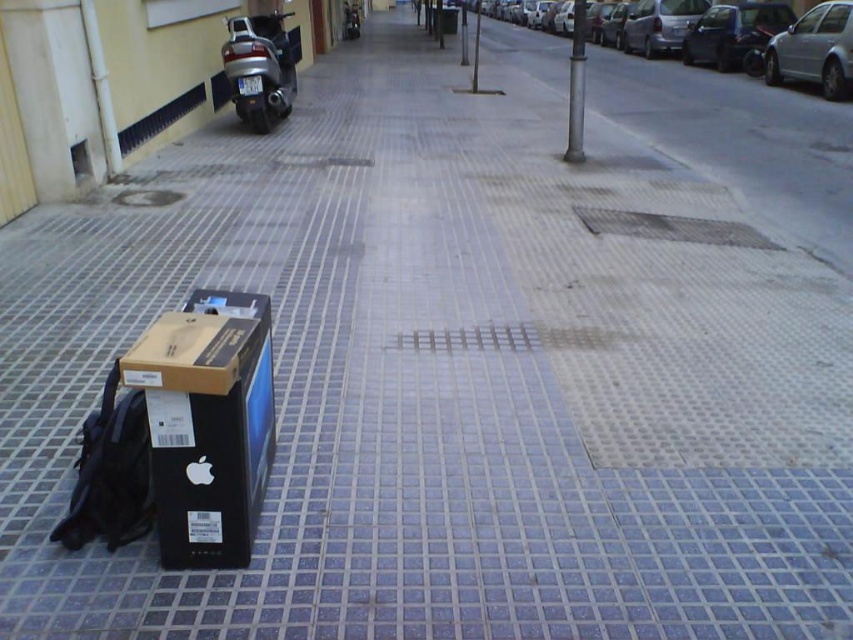
Can you confirm if silver metallic sedan at right is thinner than metallic silver motorcycle at upper center?

Indeed, silver metallic sedan at right has a lesser width compared to metallic silver motorcycle at upper center.

Can you confirm if silver metallic sedan at right is positioned above metallic silver motorcycle at upper center?

No, silver metallic sedan at right is not above metallic silver motorcycle at upper center.

Describe the element at coordinates (790, 40) in the screenshot. I see `silver metallic sedan at right` at that location.

You are a GUI agent. You are given a task and a screenshot of the screen. Output one action in this format:
    pyautogui.click(x=<x>, y=<y>)
    Task: Click on the silver metallic sedan at right
    
    Given the screenshot: What is the action you would take?
    pyautogui.click(x=790, y=40)

Who is positioned more to the left, black cardboard box at lower left or silver metallic sedan at right?

Positioned to the left is black cardboard box at lower left.

The height and width of the screenshot is (640, 853). I want to click on black cardboard box at lower left, so click(x=207, y=422).

Does metallic silver car at right have a greater width compared to metallic silver motorcycle at upper center?

Correct, the width of metallic silver car at right exceeds that of metallic silver motorcycle at upper center.

Who is positioned more to the right, metallic silver car at right or metallic silver motorcycle at upper center?

metallic silver car at right

What do you see at coordinates (732, 29) in the screenshot?
I see `metallic silver car at right` at bounding box center [732, 29].

Identify the location of metallic silver car at right. (732, 29).